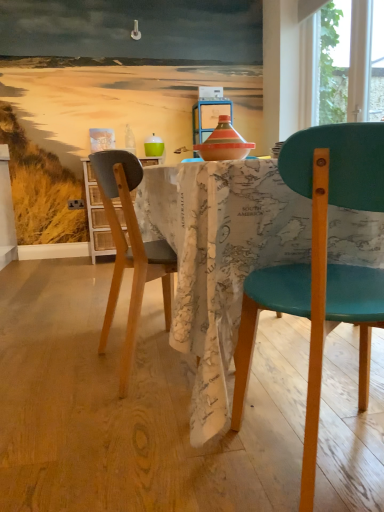
Image resolution: width=384 pixels, height=512 pixels. Find the location of `vacant region to the left of matte black chair at center, placed as the first chair when sorted from left to right`. vacant region to the left of matte black chair at center, placed as the first chair when sorted from left to right is located at coordinates (53, 367).